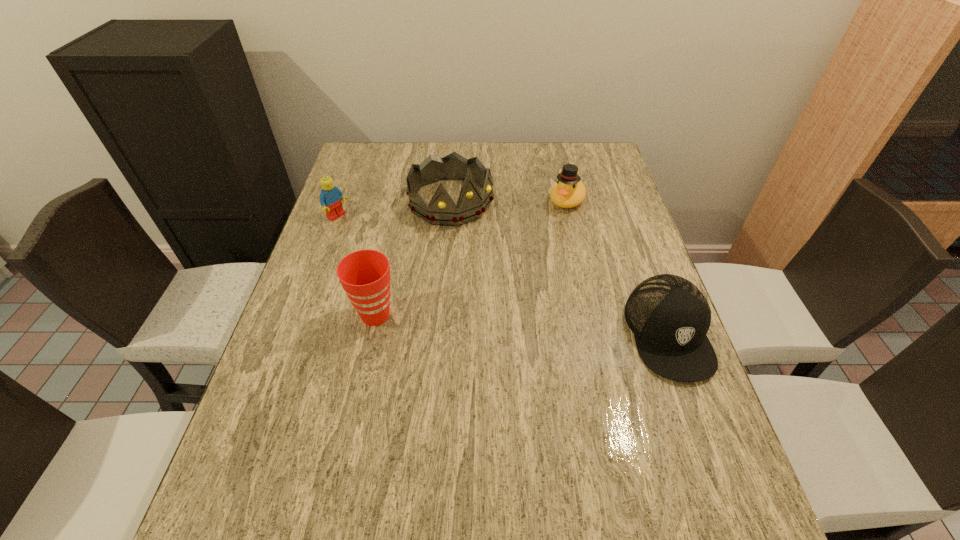
You are a GUI agent. You are given a task and a screenshot of the screen. Output one action in this format:
    pyautogui.click(x=<x>, y=<y>)
    Task: Click on the vacant spot on the desktop that is between the fourth shortest object and the rightmost object and is positioned at the front of the tallest object with jewels
    
    Given the screenshot: What is the action you would take?
    pyautogui.click(x=563, y=327)

Find the location of a particular element. The image size is (960, 540). free spot on the desktop that is between the cup and the rightmost object and is positioned on the face of the Lego is located at coordinates [x=494, y=322].

You are a GUI agent. You are given a task and a screenshot of the screen. Output one action in this format:
    pyautogui.click(x=<x>, y=<y>)
    Task: Click on the free space on the desktop that is between the second tallest object and the cap and is positioned on the front-facing side of the duck
    The height and width of the screenshot is (540, 960).
    Given the screenshot: What is the action you would take?
    pyautogui.click(x=490, y=322)